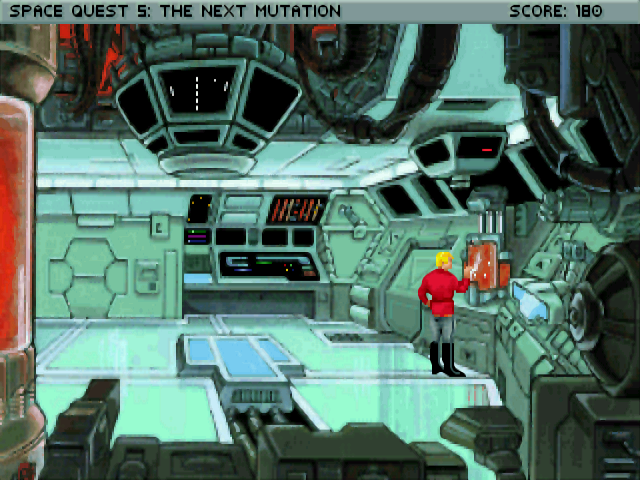
Where is `screen`? screen is located at coordinates (269, 95).